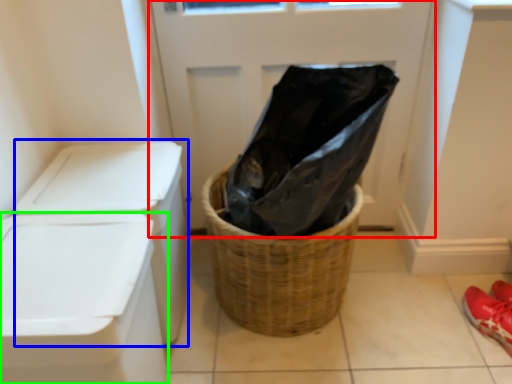
Question: Which object is the closest to the screen door (highlighted by a red box)? Choose among these: washer (highlighted by a blue box) or waste container (highlighted by a green box).

Choices:
 (A) washer
 (B) waste container

Answer: (A)